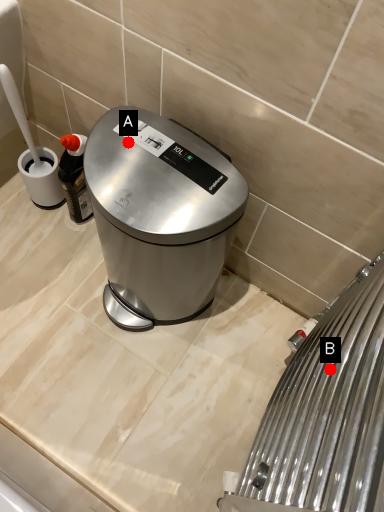
Question: Two points are circled on the image, labeled by A and B beside each circle. Which point is closer to the camera taking this photo?

Choices:
 (A) A is closer
 (B) B is closer

Answer: (B)